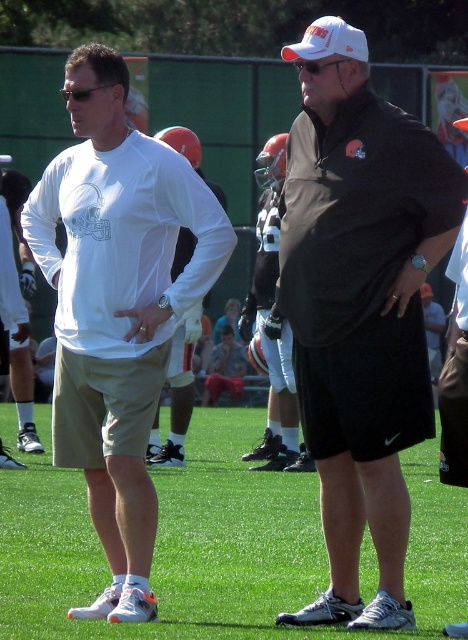
You are a photographer trying to capture a closeup of the white matte long sleeve shirt at left. You are currently positioned at the point with coordinates (117, 307). Can you confirm if you are already positioned correctly to take the photo?

The point with coordinates (117, 307) is on the white matte long sleeve shirt at left, so yes, you are positioned correctly to take the photo.

You are a photographer setting up a shot of the two athletes on the grassy field. You need to ensure that the matte black shirt at center and the green grass at center are both visible in the frame. Based on their sizes, which object will occupy more vertical space in the photo?

The matte black shirt at center is much taller than the green grass at center, so it will occupy more vertical space in the photo.

You are a photographer positioned at the center of the field. You want to take a photo of the matte black shirt at center. Based on the coordinates provided, where should you aim your camera?

The matte black shirt at center is located at coordinates point [359,307], so aim your camera at that point to capture it.